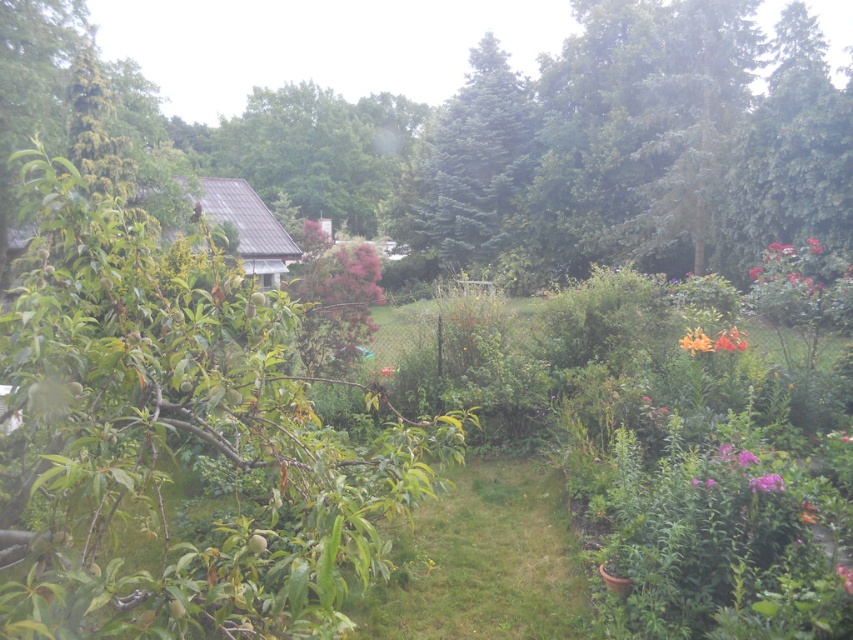
Question: Does green needle-like at center lie in front of purple matte flower at lower right?

Choices:
 (A) no
 (B) yes

Answer: (A)

Question: Does purple matte flower at lower right appear on the left side of pink matte flower at upper right?

Choices:
 (A) no
 (B) yes

Answer: (B)

Question: Estimate the real-world distances between objects in this image. Which object is farther from the orange matte flower at center-right?

Choices:
 (A) purple matte flower at center-right
 (B) pink matte flower at upper right

Answer: (B)

Question: Which point is farther to the camera?

Choices:
 (A) green grass at center
 (B) green needle-like at center

Answer: (B)

Question: Does green grass at center have a larger size compared to orange matte flower at center-right?

Choices:
 (A) yes
 (B) no

Answer: (A)

Question: Which point appears closest to the camera in this image?

Choices:
 (A) (757, 490)
 (B) (422, 173)
 (C) (811, 244)
 (D) (476, 595)

Answer: (A)